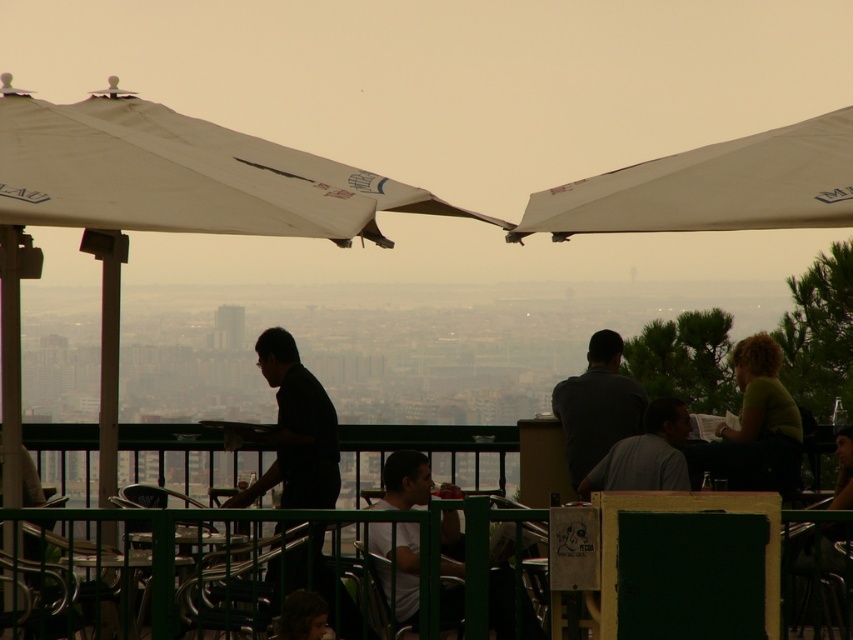
You are a photographer planning to capture the entire outdoor cafe scene. You notice the white fabric canopy at upper left and the white fabric canopy at upper right. Which canopy should you position your camera closer to in order to ensure both canopies are fully visible in the frame?

You should position your camera closer to the white fabric canopy at upper right because its smaller width compared to the white fabric canopy at upper left allows it to fit better within the frame when both are included.

You are a person who is 1.8 meters tall and standing at the green matte shirt at right. You want to reach the metallic green chair at center. Can you walk directly to it without bending down or moving any obstacles?

The distance between the green matte shirt at right and the metallic green chair at center is 3.72 meters. Since you are 1.8 meters tall, you can walk directly to the metallic green chair at center without needing to bend down or move obstacles as there is enough space between them.

You are a photographer standing at the back of the outdoor cafe scene. You want to capture a photo that includes both the white fabric canopy at upper left and the white fabric canopy at upper right. Based on their positions, which canopy should you focus on first to ensure both are in the frame?

The white fabric canopy at upper left is located below the white fabric canopy at upper right. To include both in the frame, you should focus on the white fabric canopy at upper left first since it is lower and closer to the bottom of the frame, allowing the upper one to naturally fit into the composition.